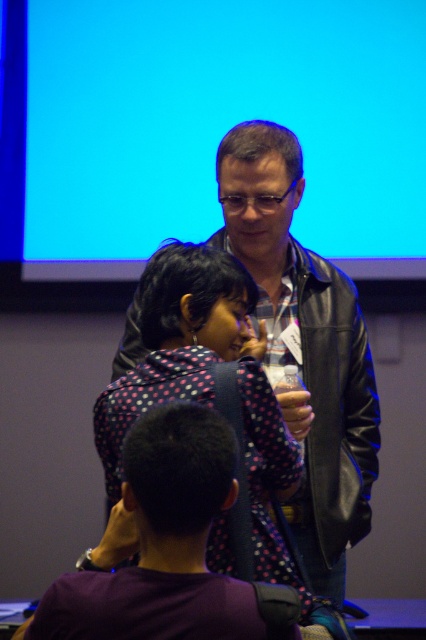
Question: Which point is closer to the camera?

Choices:
 (A) purple dotted shirt at lower center
 (B) blue matte projection screen at upper center

Answer: (A)

Question: Which point appears closest to the camera in this image?

Choices:
 (A) (344, 584)
 (B) (181, 349)

Answer: (B)

Question: Does leather jacket at center have a lesser width compared to purple dotted shirt at lower center?

Choices:
 (A) yes
 (B) no

Answer: (B)

Question: Which is farther from the leather jacket at center?

Choices:
 (A) blue matte projection screen at upper center
 (B) purple dotted shirt at lower center

Answer: (A)

Question: Can you confirm if blue matte projection screen at upper center is positioned to the left of leather jacket at center?

Choices:
 (A) yes
 (B) no

Answer: (A)

Question: Does blue matte projection screen at upper center lie in front of purple dotted shirt at lower center?

Choices:
 (A) no
 (B) yes

Answer: (A)